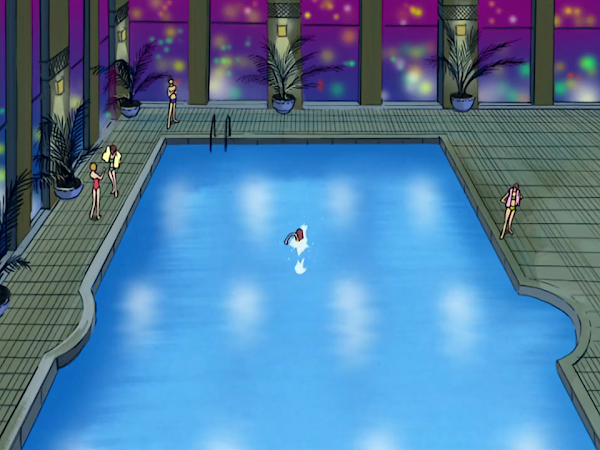
The image size is (600, 450). In order to click on beams between windows in this screenshot , I will do `click(540, 83)`, `click(452, 86)`, `click(374, 80)`, `click(299, 94)`, `click(200, 70)`, `click(120, 58)`, `click(92, 75)`, `click(61, 108)`, `click(22, 133)`.